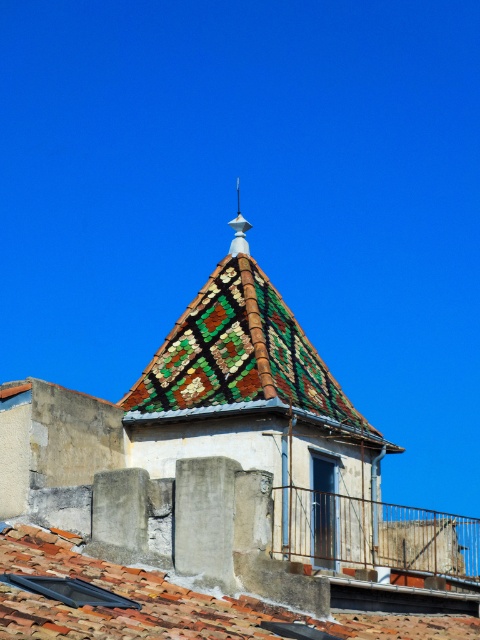
You are an architect evaluating the building design. You notice the terracotta clay tiles at lower left and the white glossy spire at upper center. Which of these two elements is positioned higher in the structure?

The white glossy spire at upper center is positioned higher than the terracotta clay tiles at lower left.

You are standing on the ground floor of the building and looking up at the roof. Which object is higher in the scene, the mosaic tile roof at center or the terracotta clay tiles at lower left?

The mosaic tile roof at center is positioned over the terracotta clay tiles at lower left, so the mosaic tile roof at center is higher in the scene.